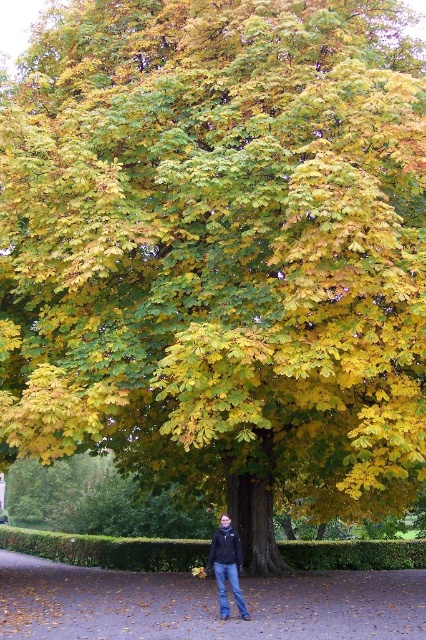
You are standing at the edge of the scene and want to walk towards the dark blue jeans at center. Which direction should you move relative to the brown dirt path at center?

To reach the dark blue jeans at center, you should move to the right of the brown dirt path at center since the path is to the left of the jeans.